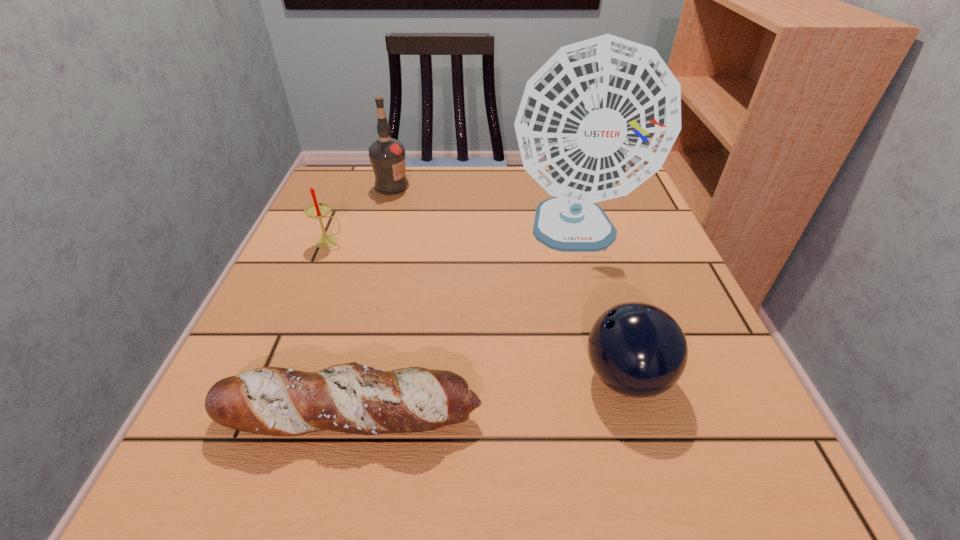
This screenshot has height=540, width=960. In order to click on vacant region at the near right corner of the desktop in this screenshot , I will do `click(667, 468)`.

The height and width of the screenshot is (540, 960). Find the location of `vacant area that lies between the candle and the baguet`. vacant area that lies between the candle and the baguet is located at coordinates (340, 328).

Identify the location of vacant space that's between the candle and the bowling ball. Image resolution: width=960 pixels, height=540 pixels. (478, 309).

Image resolution: width=960 pixels, height=540 pixels. I want to click on unoccupied position between the shortest object and the vodka, so click(x=372, y=300).

Identify the location of free space between the farthest object and the baguet. This screenshot has height=540, width=960. (372, 300).

This screenshot has height=540, width=960. What are the coordinates of `free space between the farthest object and the bowling ball` in the screenshot? It's located at (509, 281).

Where is `vacant space that is in between the candle and the bowling ball`? This screenshot has width=960, height=540. vacant space that is in between the candle and the bowling ball is located at coordinates (478, 309).

Find the location of a particular element. free space that is in between the fan and the candle is located at coordinates (452, 238).

This screenshot has height=540, width=960. I want to click on free spot between the second tallest object and the bowling ball, so pos(509,281).

Locate an element on the screen. The height and width of the screenshot is (540, 960). free area in between the second tallest object and the tallest object is located at coordinates (483, 210).